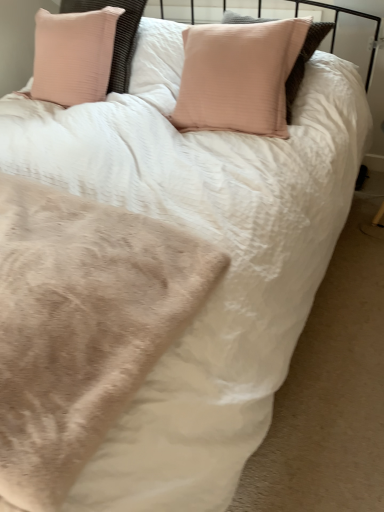
This screenshot has width=384, height=512. Describe the element at coordinates (73, 55) in the screenshot. I see `pink plush pillow at upper left` at that location.

Identify the location of pink plush pillow at upper left. (73, 55).

The height and width of the screenshot is (512, 384). Describe the element at coordinates (81, 326) in the screenshot. I see `beige plush blanket at lower left` at that location.

You are a GUI agent. You are given a task and a screenshot of the screen. Output one action in this format:
    pyautogui.click(x=<x>, y=<y>)
    Task: Click on the beige plush blanket at lower left
    The image size is (384, 512).
    Given the screenshot: What is the action you would take?
    pyautogui.click(x=81, y=326)

What are the coordinates of `pink plush pillow at upper left` in the screenshot? It's located at (73, 55).

Considering the relative positions of beige plush blanket at lower left and pink plush pillow at upper left in the image provided, is beige plush blanket at lower left to the right of pink plush pillow at upper left from the viewer's perspective?

Correct, you'll find beige plush blanket at lower left to the right of pink plush pillow at upper left.

Which object is closer to the camera, beige plush blanket at lower left or pink plush pillow at upper left?

beige plush blanket at lower left is more forward.

Does point (159, 265) appear closer or farther from the camera than point (38, 29)?

Point (159, 265) is positioned closer to the camera compared to point (38, 29).

From the image's perspective, is beige plush blanket at lower left under pink plush pillow at upper left?

Yes.

From a real-world perspective, which object rests below the other?

beige plush blanket at lower left.

In terms of width, does beige plush blanket at lower left look wider or thinner when compared to pink plush pillow at upper left?

Clearly, beige plush blanket at lower left has more width compared to pink plush pillow at upper left.

Considering the relative sizes of beige plush blanket at lower left and pink plush pillow at upper left in the image provided, is beige plush blanket at lower left taller than pink plush pillow at upper left?

No.

Which of these two, beige plush blanket at lower left or pink plush pillow at upper left, is bigger?

pink plush pillow at upper left is bigger.

Is beige plush blanket at lower left inside the boundaries of pink plush pillow at upper left, or outside?

beige plush blanket at lower left lies outside pink plush pillow at upper left.

Does beige plush blanket at lower left touch pink plush pillow at upper left?

There is a gap between beige plush blanket at lower left and pink plush pillow at upper left.

Could you tell me if beige plush blanket at lower left is facing pink plush pillow at upper left?

No, beige plush blanket at lower left does not turn towards pink plush pillow at upper left.

Based on the photo, can you tell me how much beige plush blanket at lower left and pink plush pillow at upper left differ in facing direction?

There is a 2.05-degree angle between the facing directions of beige plush blanket at lower left and pink plush pillow at upper left.

This screenshot has height=512, width=384. I want to click on blanket below the pink plush pillow at upper left (from the image's perspective), so click(x=81, y=326).

Can you confirm if pink plush pillow at upper left is positioned to the left of beige plush blanket at lower left?

Correct, you'll find pink plush pillow at upper left to the left of beige plush blanket at lower left.

Is the depth of pink plush pillow at upper left less than that of beige plush blanket at lower left?

No, the depth of pink plush pillow at upper left is greater than that of beige plush blanket at lower left.

Does point (56, 24) appear closer or farther from the camera than point (44, 272)?

Point (56, 24) is farther from the camera than point (44, 272).

From the image's perspective, which is below, pink plush pillow at upper left or beige plush blanket at lower left?

beige plush blanket at lower left.

From a real-world perspective, does pink plush pillow at upper left sit lower than beige plush blanket at lower left?

No.

Considering the relative sizes of pink plush pillow at upper left and beige plush blanket at lower left in the image provided, is pink plush pillow at upper left wider than beige plush blanket at lower left?

In fact, pink plush pillow at upper left might be narrower than beige plush blanket at lower left.

Who is taller, pink plush pillow at upper left or beige plush blanket at lower left?

pink plush pillow at upper left is taller.

Looking at this image, who is bigger, pink plush pillow at upper left or beige plush blanket at lower left?

pink plush pillow at upper left is bigger.

Which is correct: pink plush pillow at upper left is inside beige plush blanket at lower left, or outside of it?

pink plush pillow at upper left is not inside beige plush blanket at lower left, it's outside.

Are pink plush pillow at upper left and beige plush blanket at lower left located far from each other?

Yes, pink plush pillow at upper left and beige plush blanket at lower left are quite far apart.

Is beige plush blanket at lower left at the back of pink plush pillow at upper left?

pink plush pillow at upper left does not have its back to beige plush blanket at lower left.

In the scene shown: Can you tell me how much pink plush pillow at upper left and beige plush blanket at lower left differ in facing direction?

2.05 degrees.

Identify the location of blanket that appears below the pink plush pillow at upper left (from a real-world perspective). (81, 326).

Locate an element on the screen. The image size is (384, 512). pillow above the beige plush blanket at lower left (from a real-world perspective) is located at coordinates (73, 55).

Find the location of a particular element. The height and width of the screenshot is (512, 384). blanket that appears on the right of pink plush pillow at upper left is located at coordinates (81, 326).